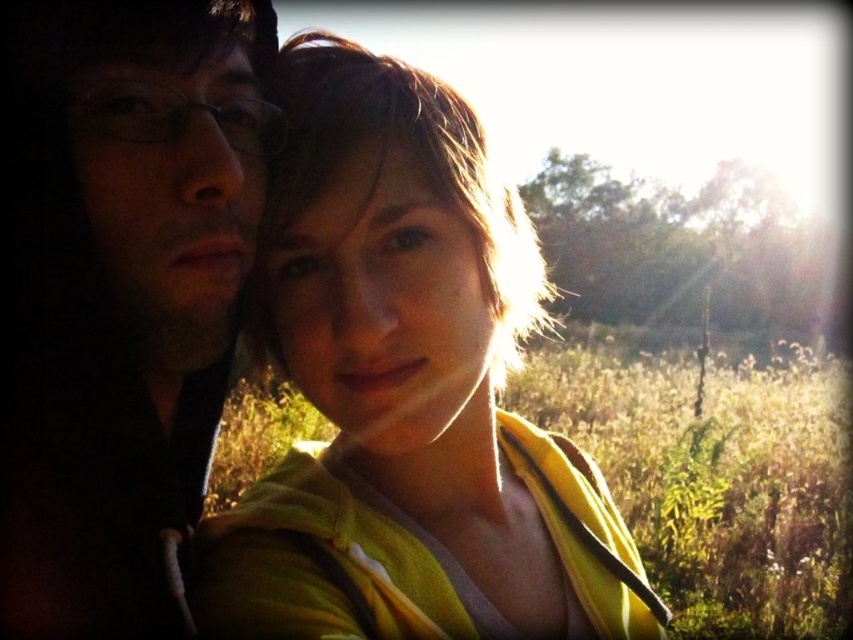
Can you confirm if yellow fabric at center is positioned to the right of matte black hoodie at left?

Correct, you'll find yellow fabric at center to the right of matte black hoodie at left.

Consider the image. Can you confirm if yellow fabric at center is wider than matte black hoodie at left?

Yes, yellow fabric at center is wider than matte black hoodie at left.

You are a GUI agent. You are given a task and a screenshot of the screen. Output one action in this format:
    pyautogui.click(x=<x>, y=<y>)
    Task: Click on the yellow fabric at center
    
    Given the screenshot: What is the action you would take?
    pyautogui.click(x=408, y=392)

Find the location of a particular element. The height and width of the screenshot is (640, 853). yellow fabric at center is located at coordinates (408, 392).